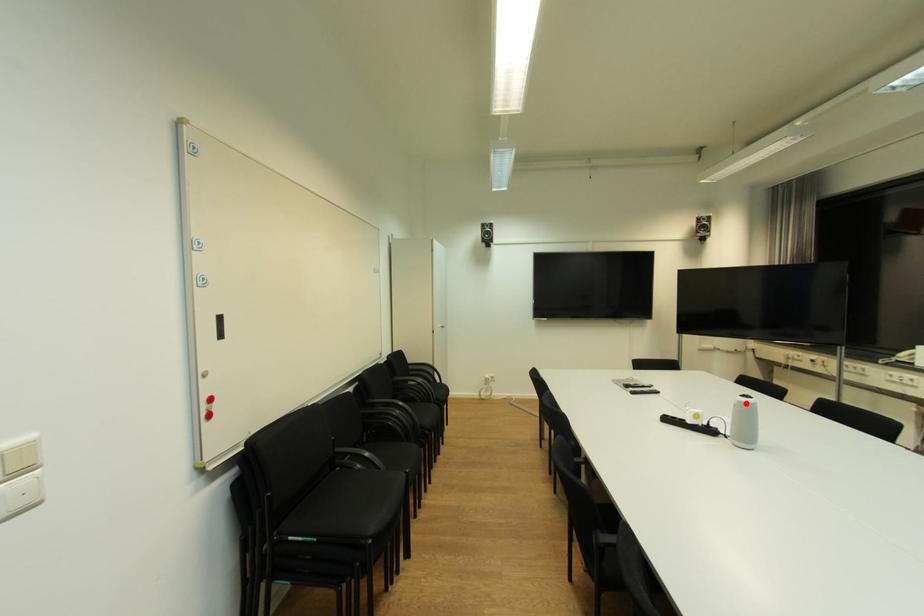
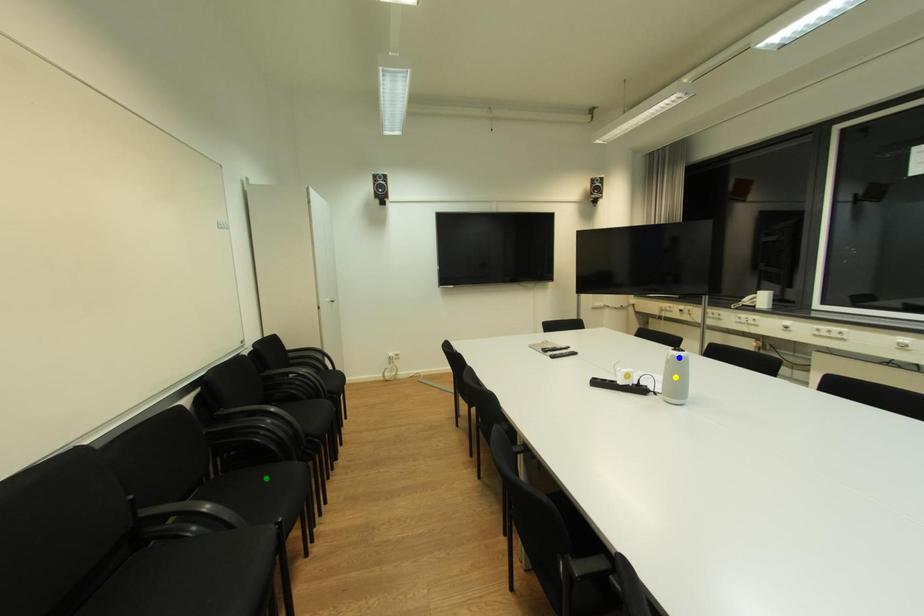
Question: I am providing you with two images of the same scene from different viewpoints. A red point is marked on the first image. You are given multiple points on the second image. Which point in image 2 represents the same 3d spot as the red point in image 1?

Choices:
 (A) green point
 (B) yellow point
 (C) blue point

Answer: (C)